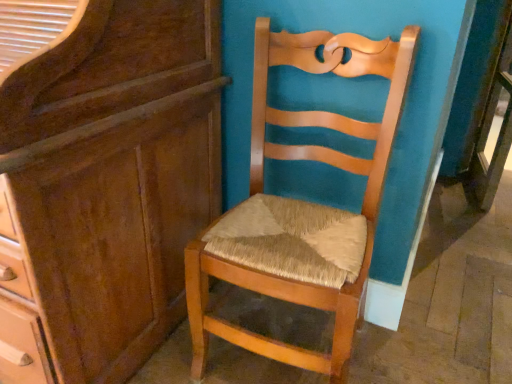
What do you see at coordinates (102, 179) in the screenshot? This screenshot has height=384, width=512. I see `matte brown cabinet at left` at bounding box center [102, 179].

The image size is (512, 384). Find the location of `matte brown cabinet at left`. matte brown cabinet at left is located at coordinates (102, 179).

The image size is (512, 384). What do you see at coordinates (301, 206) in the screenshot?
I see `natural wood chair at center` at bounding box center [301, 206].

This screenshot has width=512, height=384. I want to click on natural wood chair at center, so click(x=301, y=206).

Measure the distance between natural wood chair at center and camera.

natural wood chair at center and camera are 35.26 inches apart.

The width and height of the screenshot is (512, 384). Identify the location of matte brown cabinet at left. (102, 179).

Would you say natural wood chair at center is to the left or to the right of matte brown cabinet at left in the picture?

From the image, it's evident that natural wood chair at center is to the right of matte brown cabinet at left.

Considering their positions, is natural wood chair at center located in front of or behind matte brown cabinet at left?

Visually, natural wood chair at center is located behind matte brown cabinet at left.

Is point (205, 299) farther from camera compared to point (139, 336)?

No, it is in front of (139, 336).

From the image's perspective, relative to matte brown cabinet at left, is natural wood chair at center above or below?

natural wood chair at center is below matte brown cabinet at left.

From a real-world perspective, relative to matte brown cabinet at left, is natural wood chair at center vertically above or below?

Clearly, from a real-world perspective, natural wood chair at center is below matte brown cabinet at left.

Which object is thinner, natural wood chair at center or matte brown cabinet at left?

With smaller width is natural wood chair at center.

Does natural wood chair at center have a lesser height compared to matte brown cabinet at left?

Yes, natural wood chair at center is shorter than matte brown cabinet at left.

Can you confirm if natural wood chair at center is smaller than matte brown cabinet at left?

Indeed, natural wood chair at center has a smaller size compared to matte brown cabinet at left.

Consider the image. Is natural wood chair at center located outside matte brown cabinet at left?

Yes, natural wood chair at center is not within matte brown cabinet at left.

Is natural wood chair at center directly adjacent to matte brown cabinet at left?

No, natural wood chair at center is not with matte brown cabinet at left.

Is natural wood chair at center facing towards matte brown cabinet at left?

No, natural wood chair at center is not oriented towards matte brown cabinet at left.

What's the angular difference between natural wood chair at center and matte brown cabinet at left's facing directions?

They differ by 1.06 degrees in their facing directions.

How much distance is there between natural wood chair at center and matte brown cabinet at left?

natural wood chair at center is 12.81 inches from matte brown cabinet at left.

Where is `cabinetry on the left of the natural wood chair at center`? cabinetry on the left of the natural wood chair at center is located at coordinates point(102,179).

Which object is positioned more to the right, matte brown cabinet at left or natural wood chair at center?

natural wood chair at center is more to the right.

Consider the image. Does matte brown cabinet at left come behind natural wood chair at center?

No, the depth of matte brown cabinet at left is less than that of natural wood chair at center.

Is point (110, 201) closer to camera compared to point (277, 341)?

Yes.

From the image's perspective, which is below, matte brown cabinet at left or natural wood chair at center?

natural wood chair at center, from the image's perspective.

Based on the photo, from a real-world perspective, is matte brown cabinet at left located higher than natural wood chair at center?

Yes, from a real-world perspective, matte brown cabinet at left is over natural wood chair at center

Considering the sizes of objects matte brown cabinet at left and natural wood chair at center in the image provided, who is wider, matte brown cabinet at left or natural wood chair at center?

With larger width is matte brown cabinet at left.

Which of these two, matte brown cabinet at left or natural wood chair at center, stands shorter?

natural wood chair at center is shorter.

Does matte brown cabinet at left have a larger size compared to natural wood chair at center?

Correct, matte brown cabinet at left is larger in size than natural wood chair at center.

Could natural wood chair at center be considered to be inside matte brown cabinet at left?

No, natural wood chair at center is not inside matte brown cabinet at left.

Is matte brown cabinet at left next to natural wood chair at center?

They are not placed beside each other.

Does matte brown cabinet at left turn towards natural wood chair at center?

No.

This screenshot has height=384, width=512. In the image, there is a matte brown cabinet at left. Identify the location of chair below it (from the image's perspective). (301, 206).

Locate an element on the screen. cabinetry above the natural wood chair at center (from the image's perspective) is located at coordinates (102, 179).

The width and height of the screenshot is (512, 384). Find the location of `cabinetry on the left side of natural wood chair at center`. cabinetry on the left side of natural wood chair at center is located at coordinates (102, 179).